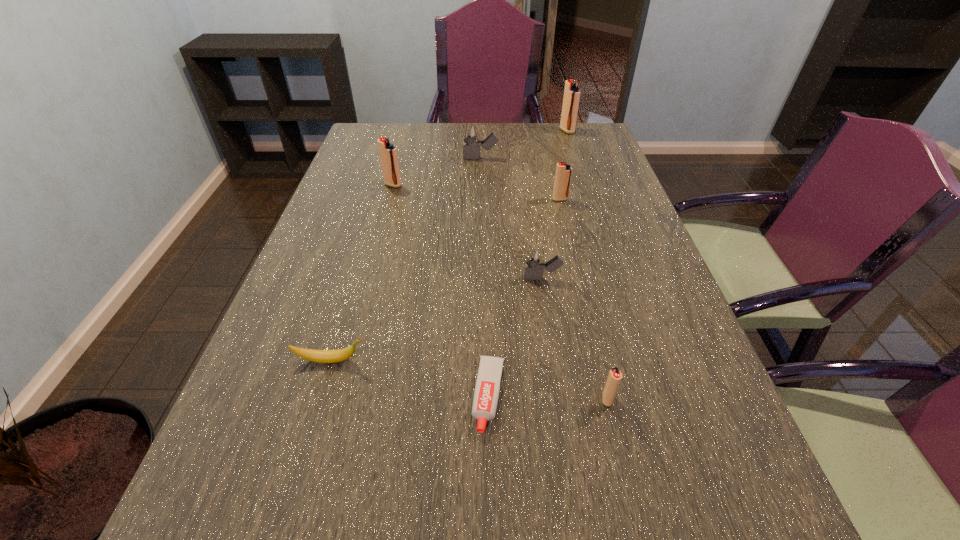
You are a GUI agent. You are given a task and a screenshot of the screen. Output one action in this format:
    pyautogui.click(x=<x>, y=<y>)
    Task: Click on the empty space between the toothpaste and the third smallest red igniter
    The width and height of the screenshot is (960, 540).
    Given the screenshot: What is the action you would take?
    pyautogui.click(x=441, y=291)

Locate an element on the screen. Image resolution: width=960 pixels, height=540 pixels. vacant region between the farthest igniter and the right gray igniter is located at coordinates (555, 205).

You are a GUI agent. You are given a task and a screenshot of the screen. Output one action in this format:
    pyautogui.click(x=<x>, y=<y>)
    Task: Click on the unoccupied area between the fourth farthest object and the toothpaste
    
    Given the screenshot: What is the action you would take?
    pyautogui.click(x=524, y=298)

At what (x,y) coordinates should I click in order to perform the action: click on free space between the farther gray igniter and the shortest object. Please return your answer as a coordinate pair (x, y). The width and height of the screenshot is (960, 540). Looking at the image, I should click on (485, 277).

Where is `vacant space that's between the fifth nearest object and the toothpaste`? vacant space that's between the fifth nearest object and the toothpaste is located at coordinates pos(524,298).

Where is `free space between the second farthest igniter and the fourth igniter from right to left`? The width and height of the screenshot is (960, 540). free space between the second farthest igniter and the fourth igniter from right to left is located at coordinates (512, 218).

You are a GUI agent. You are given a task and a screenshot of the screen. Output one action in this format:
    pyautogui.click(x=<x>, y=<y>)
    Task: Click on the vacant space that's between the second farthest red igniter and the seventh tallest object
    The height and width of the screenshot is (540, 960).
    Given the screenshot: What is the action you would take?
    pyautogui.click(x=362, y=273)

You are a GUI agent. You are given a task and a screenshot of the screen. Output one action in this format:
    pyautogui.click(x=<x>, y=<y>)
    Task: Click on the blank region between the seventh shortest object and the yellow banana
    This screenshot has height=540, width=960.
    Given the screenshot: What is the action you would take?
    pyautogui.click(x=362, y=273)

Find the location of `free space between the fourth farthest object and the fourth igniter from right to left`. free space between the fourth farthest object and the fourth igniter from right to left is located at coordinates (551, 239).

You are a GUI agent. You are given a task and a screenshot of the screen. Output one action in this format:
    pyautogui.click(x=<x>, y=<y>)
    Task: Click on the unoccupied position between the left gray igniter and the fifth farthest object
    The height and width of the screenshot is (540, 960).
    Given the screenshot: What is the action you would take?
    pyautogui.click(x=512, y=218)